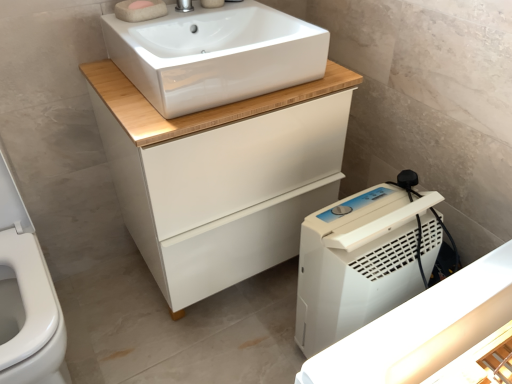
Question: Can you confirm if silver metallic tap at upper center is wider than pink sponge at upper center?

Choices:
 (A) yes
 (B) no

Answer: (A)

Question: Is silver metallic tap at upper center behind pink sponge at upper center?

Choices:
 (A) no
 (B) yes

Answer: (A)

Question: Is the surface of silver metallic tap at upper center in direct contact with pink sponge at upper center?

Choices:
 (A) no
 (B) yes

Answer: (B)

Question: Can you confirm if silver metallic tap at upper center is shorter than pink sponge at upper center?

Choices:
 (A) no
 (B) yes

Answer: (A)

Question: Does silver metallic tap at upper center have a lesser width compared to pink sponge at upper center?

Choices:
 (A) yes
 (B) no

Answer: (B)

Question: Is silver metallic tap at upper center oriented towards pink sponge at upper center?

Choices:
 (A) yes
 (B) no

Answer: (B)

Question: Is silver metallic tap at upper center located outside white matte cabinet at center?

Choices:
 (A) no
 (B) yes

Answer: (B)

Question: Is white matte cabinet at center a part of silver metallic tap at upper center?

Choices:
 (A) yes
 (B) no

Answer: (B)

Question: Is silver metallic tap at upper center positioned behind white matte cabinet at center?

Choices:
 (A) no
 (B) yes

Answer: (B)

Question: From a real-world perspective, is silver metallic tap at upper center on top of white matte cabinet at center?

Choices:
 (A) yes
 (B) no

Answer: (A)

Question: From the image's perspective, is silver metallic tap at upper center below white matte cabinet at center?

Choices:
 (A) no
 (B) yes

Answer: (A)

Question: Is silver metallic tap at upper center taller than white matte cabinet at center?

Choices:
 (A) yes
 (B) no

Answer: (B)

Question: Does white plastic dehumidifier at lower right have a lesser height compared to pink sponge at upper center?

Choices:
 (A) yes
 (B) no

Answer: (B)